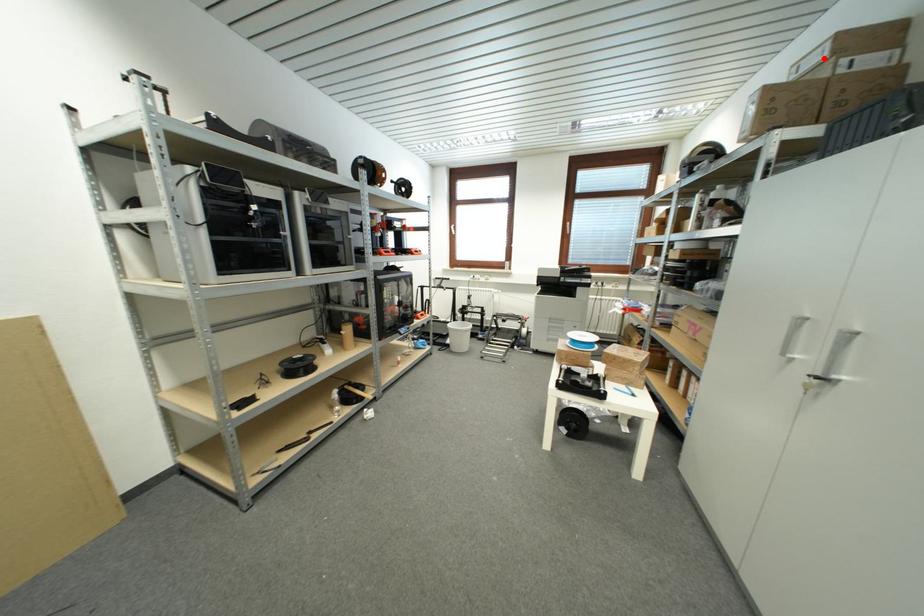
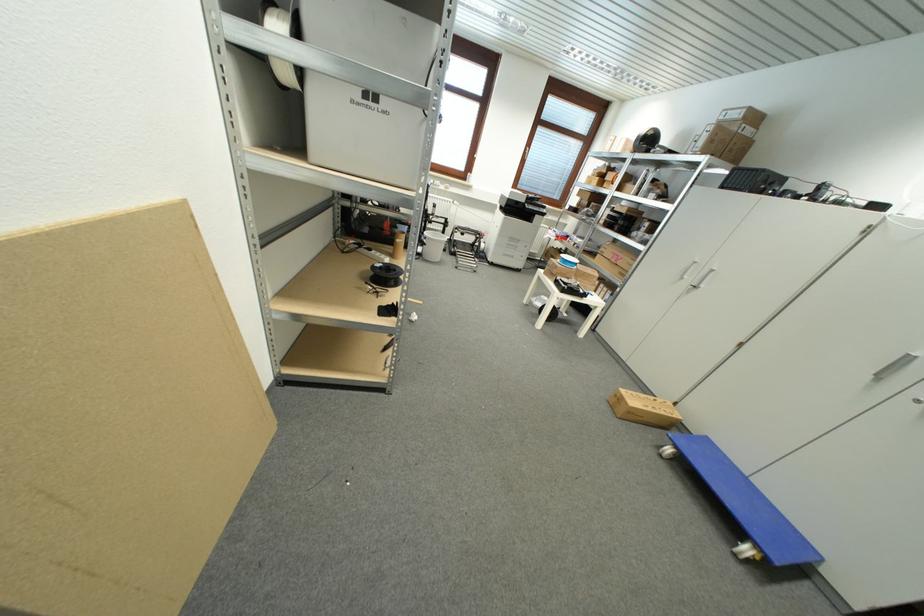
In the second image, find the point that corresponds to the highlighted location in the first image.

(742, 116)